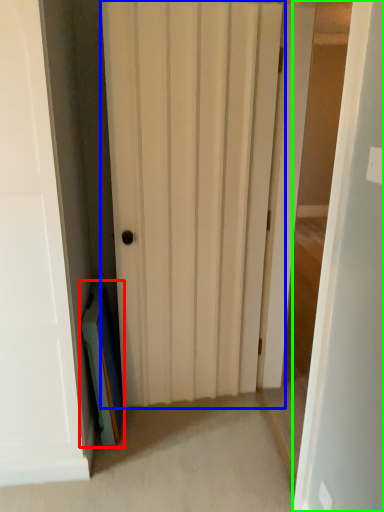
Question: Estimate the real-world distances between objects in this image. Which object is closer to book (highlighted by a red box), door (highlighted by a blue box) or door (highlighted by a green box)?

Choices:
 (A) door
 (B) door

Answer: (A)